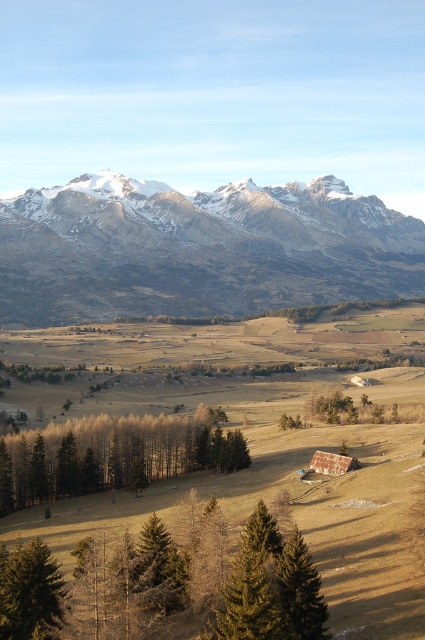
You are standing at the base of the mountain and see the snowy granite mountain range at upper center. If you want to reach the point marked at point (198,248), which direction should you head towards?

The snowy granite mountain range at upper center is located at point (198,248), so you should head towards the upper center direction to reach that point.

You are standing at the point with coordinates point (221, 545) and want to walk towards the point (25, 492). Based on the scene description, will you be moving towards the foreground or the background of the image?

You are moving towards the background of the image because point (25, 492) is behind point (221, 545).

You are a hiker planning to set up a tent between the green matte tree at lower center and the green matte tree at lower left. Can you determine which tree is closer to the ground where you want to pitch your tent?

The green matte tree at lower center is positioned under the green matte tree at lower left, so the green matte tree at lower center is closer to the ground where you want to pitch your tent.